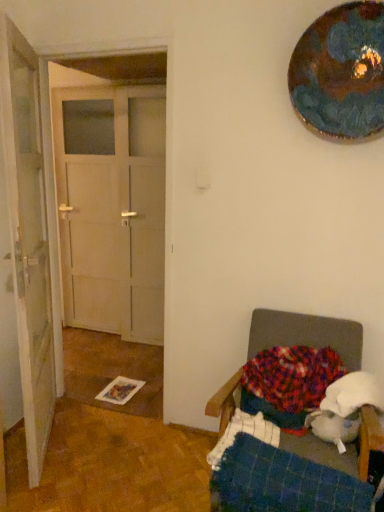
Find the location of a particular element. free point above white matte door at left, which is the 1th door from right to left (from a real-world perspective) is located at coordinates (100, 44).